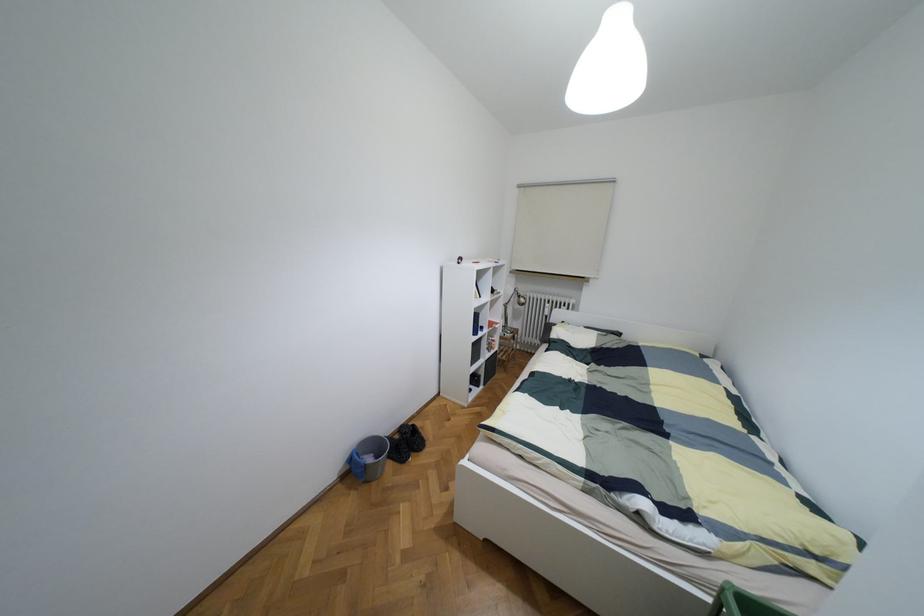
Where would you adjust the silver lamp head? Please return your answer as a coordinate pair (x, y).

(520, 299)